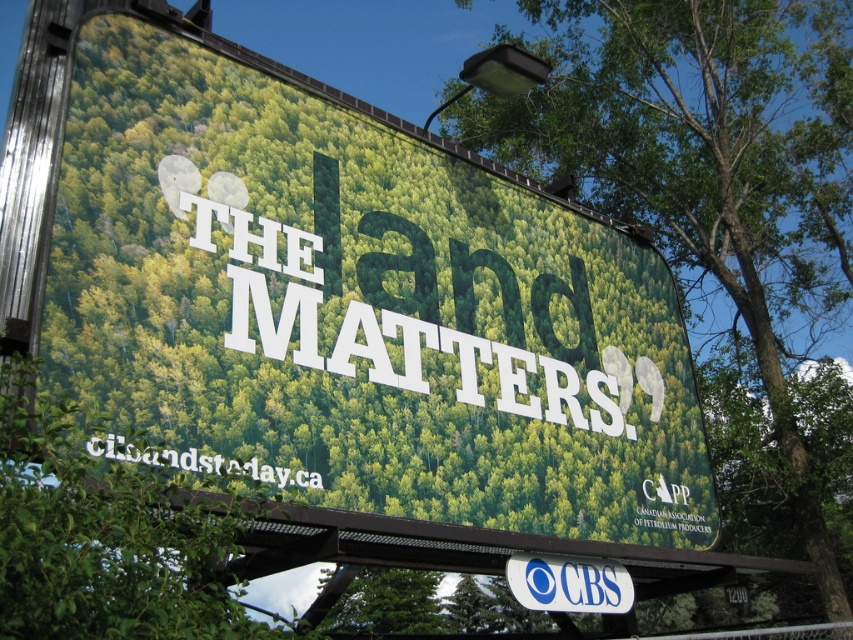
You are a pedestrian standing on the sidewalk in front of the billboard. You want to take a photo of the blue plastic cbs sign at center without the green matte billboard at upper center appearing in the shot. Is this possible given their relative sizes?

The green matte billboard at upper center is taller than the blue plastic cbs sign at center. Since the billboard is taller, it might block the view of the CBS sign if they are positioned close together. However, if you move closer to the CBS sign and angle your camera downward, you might be able to frame the shot so that the billboard isn

You are standing in front of the billboard and want to point out the green leafy tree at lower left and the blue plastic cbs sign at center to someone. Which one is positioned to the left of the other?

The green leafy tree at lower left is to the left of the blue plastic cbs sign at center.

You are standing in front of the billboard and want to touch both points on it. Which point should you reach for first, point [577,218] or point [608,563]?

You should reach for point [577,218] first because it is closer to you than point [608,563].